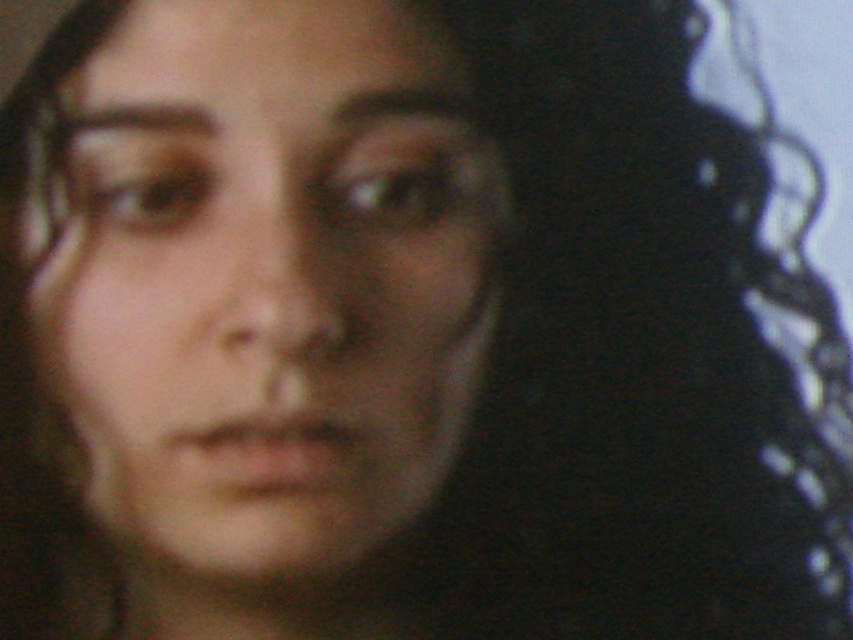
Is point (323, 112) closer to viewer compared to point (91, 214)?

Yes, point (323, 112) is closer to viewer.

Between point (235, 256) and point (119, 220), which one is positioned in front?

Point (235, 256)

What do you see at coordinates (260, 282) in the screenshot? I see `smooth skin face at center` at bounding box center [260, 282].

This screenshot has width=853, height=640. I want to click on smooth skin face at center, so click(260, 282).

Is smooth skin face at center thinner than matte black eye at center?

No.

Where is `smooth skin face at center`? The width and height of the screenshot is (853, 640). smooth skin face at center is located at coordinates (260, 282).

The height and width of the screenshot is (640, 853). I want to click on smooth skin face at center, so click(x=260, y=282).

Is point (372, 200) farther from viewer compared to point (120, 218)?

That is True.

Does matte black eye at center come behind brown matte eye at upper left?

Yes, it is behind brown matte eye at upper left.

Is point (386, 188) positioned in front of point (163, 224)?

That is False.

Where is `matte black eye at center`? The width and height of the screenshot is (853, 640). matte black eye at center is located at coordinates (399, 189).